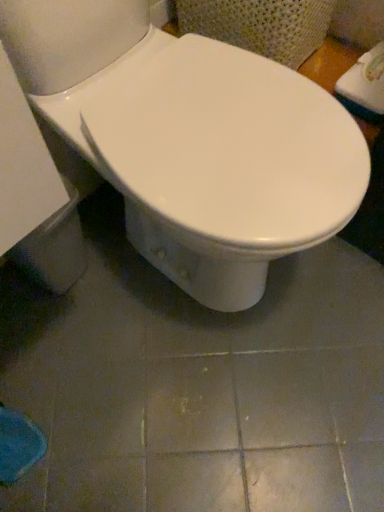
Identify the location of vacant space underneath white glossy bidet at center (from a real-world perspective). Image resolution: width=384 pixels, height=512 pixels. (188, 285).